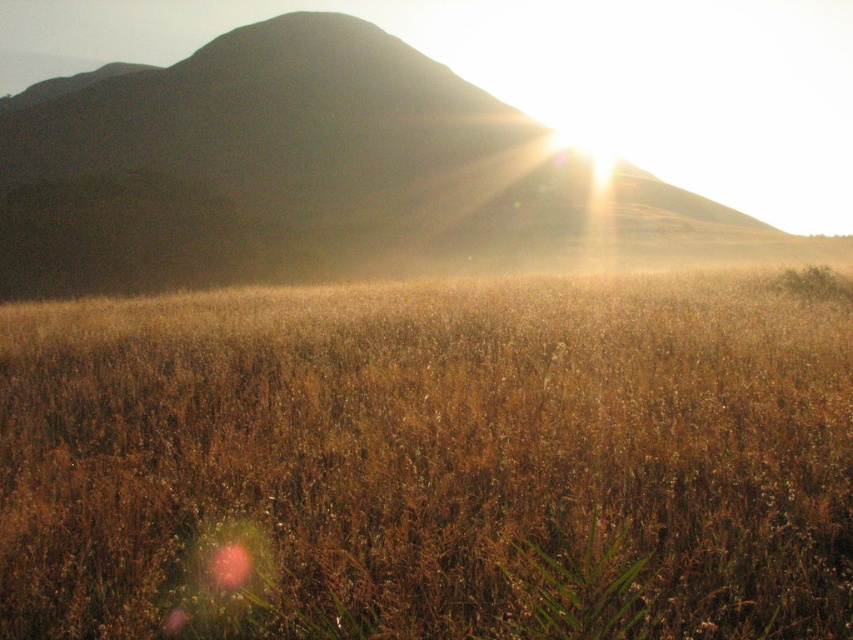
Is golden grassy field at center bigger than silhouetted rock formation at upper center?

Incorrect, golden grassy field at center is not larger than silhouetted rock formation at upper center.

Can you confirm if golden grassy field at center is taller than silhouetted rock formation at upper center?

No.

Where is `golden grassy field at center`? This screenshot has width=853, height=640. golden grassy field at center is located at coordinates (430, 461).